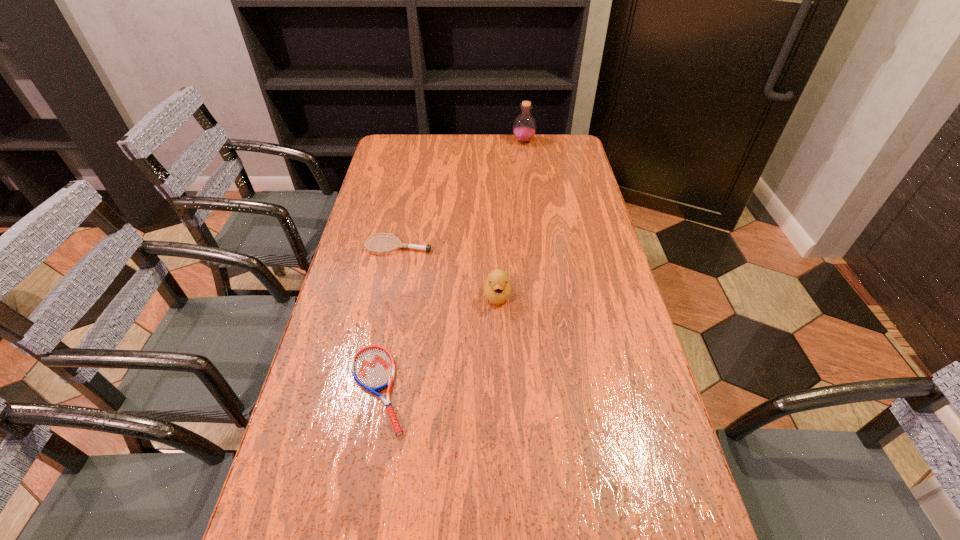
I want to click on the farthest object, so pyautogui.click(x=524, y=127).

Locate an element on the screen. This screenshot has height=540, width=960. bottle is located at coordinates (524, 127).

The height and width of the screenshot is (540, 960). I want to click on the second tallest object, so click(497, 288).

The image size is (960, 540). Identify the location of the third object from left to right. tap(497, 288).

Identify the location of the taller tennis racket. (399, 245).

In order to click on the farther tennis racket in this screenshot , I will do `click(399, 245)`.

Find the location of `the shortest object`. the shortest object is located at coordinates (373, 367).

The height and width of the screenshot is (540, 960). I want to click on the nearer tennis racket, so click(373, 367).

Image resolution: width=960 pixels, height=540 pixels. I want to click on free point located 0.180m on the front of the farthest object, so click(528, 171).

Image resolution: width=960 pixels, height=540 pixels. I want to click on free region located 0.090m on the face of the duckling, so coord(499,338).